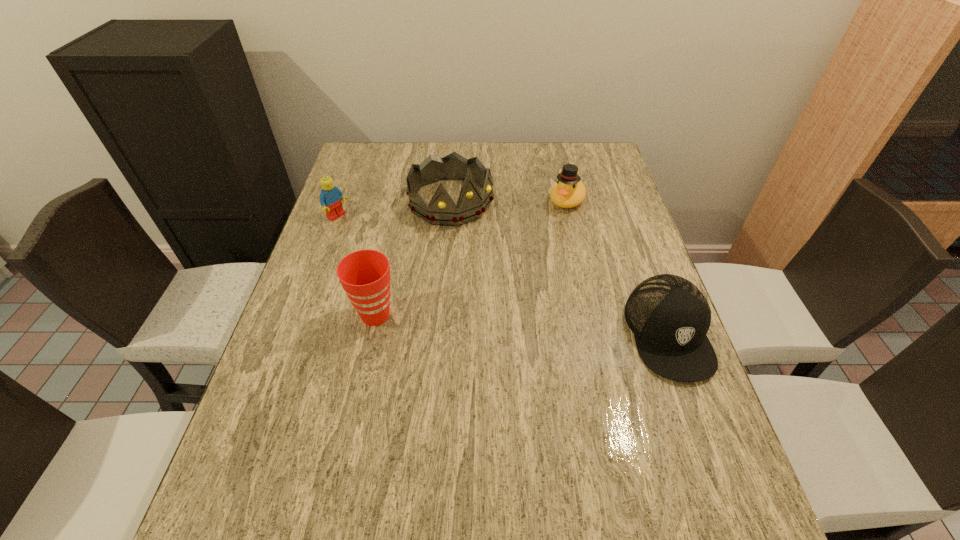
Identify the location of empty space that is in between the tallest object and the second tallest object. The image size is (960, 540). (413, 258).

The width and height of the screenshot is (960, 540). In order to click on unoccupied position between the cap and the cup in this screenshot , I will do 522,324.

Locate an element on the screen. Image resolution: width=960 pixels, height=540 pixels. free area in between the duck and the cap is located at coordinates (617, 267).

Where is `empty location between the duck and the tiara`? Image resolution: width=960 pixels, height=540 pixels. empty location between the duck and the tiara is located at coordinates point(509,201).

Identify the location of vacant space that is in between the tallest object and the second object from right to left. (509, 201).

Identify which object is located as the second nearest to the cup. Please provide its 2D coordinates. Your answer should be formatted as a tuple, i.e. [(x, y)], where the tuple contains the x and y coordinates of a point satisfying the conditions above.

[(330, 198)]

Image resolution: width=960 pixels, height=540 pixels. In order to click on object that is the third nearest to the cap in this screenshot , I will do `click(365, 274)`.

This screenshot has width=960, height=540. I want to click on vacant space that satisfies the following two spatial constraints: 1. on the back side of the tallest object; 2. on the right side of the duck, so click(x=450, y=200).